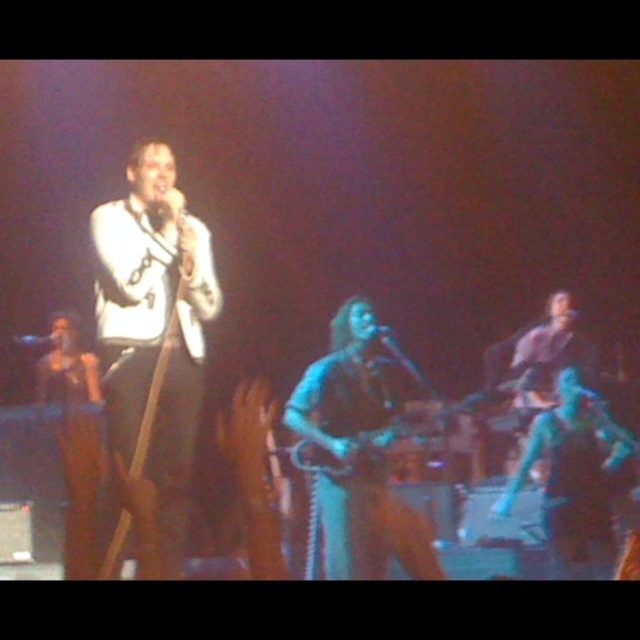
Question: Can you confirm if metallic silver microphone at upper center is positioned below metallic blue microphone at center?

Choices:
 (A) no
 (B) yes

Answer: (B)

Question: Which object is closer to the camera taking this photo?

Choices:
 (A) metallic silver microphone at upper center
 (B) blue fabric pants at right

Answer: (B)

Question: Does blue leather jacket at center lie behind metallic silver microphone at upper center?

Choices:
 (A) yes
 (B) no

Answer: (B)

Question: Is blue leather jacket at center closer to the viewer compared to metallic silver microphone at upper center?

Choices:
 (A) no
 (B) yes

Answer: (B)

Question: Which point appears farthest from the camera in this image?

Choices:
 (A) (49, 336)
 (B) (604, 433)

Answer: (A)

Question: Which is farther from the blue leather jacket at center?

Choices:
 (A) metallic silver microphone at upper center
 (B) metallic blue microphone at center

Answer: (A)